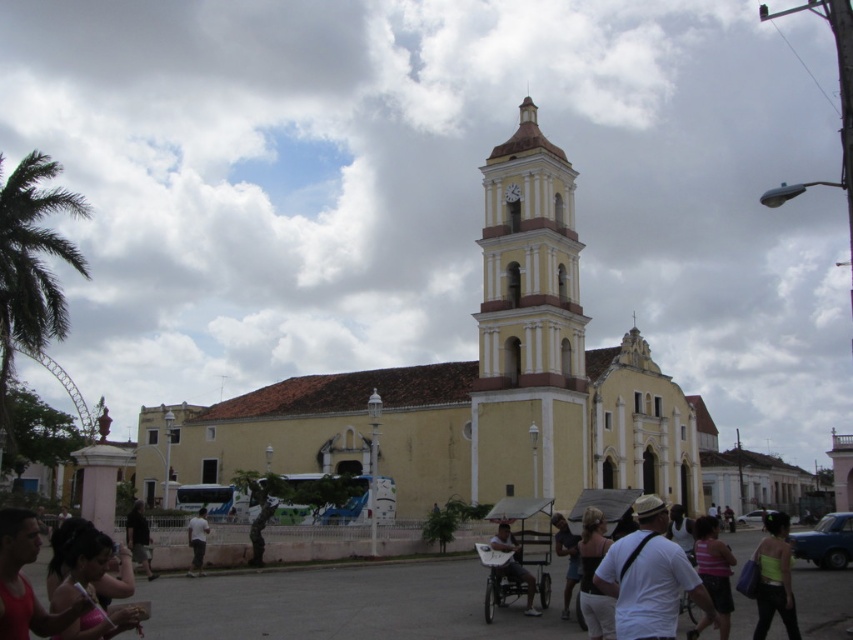
Question: Can you confirm if green fabric top at lower right is smaller than light brown leather jacket at center?

Choices:
 (A) yes
 (B) no

Answer: (B)

Question: Estimate the real-world distances between objects in this image. Which object is farther from the light brown leather jacket at center?

Choices:
 (A) green fabric top at lower right
 (B) matte black cart at center

Answer: (A)

Question: Is dark brown hair at lower left positioned at the back of dark brown leather pants at lower left?

Choices:
 (A) no
 (B) yes

Answer: (A)

Question: Which point is closer to the camera?

Choices:
 (A) 778,564
 (B) 195,563

Answer: (A)

Question: Which of the following is the closest to the observer?

Choices:
 (A) coord(136,512)
 (B) coord(514,552)
 (C) coord(762,579)
 (D) coord(714,588)

Answer: (C)

Question: Considering the relative positions of shiny pink bikini at lower left and dark brown leather pants at lower left in the image provided, where is shiny pink bikini at lower left located with respect to dark brown leather pants at lower left?

Choices:
 (A) below
 (B) above

Answer: (B)